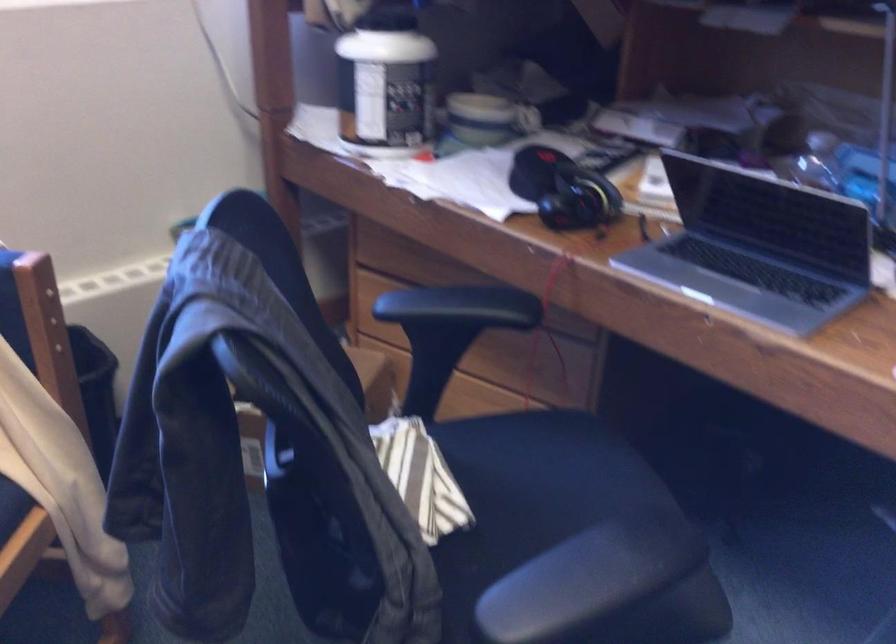
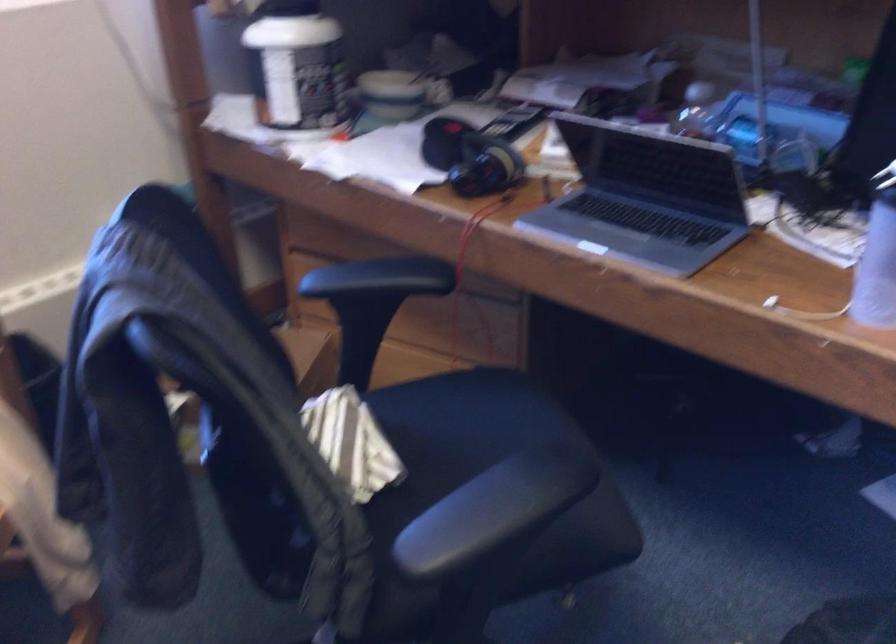
In a continuous first-person perspective shot, in which direction is the camera moving?

The movement direction of the cameraman is right, backward.